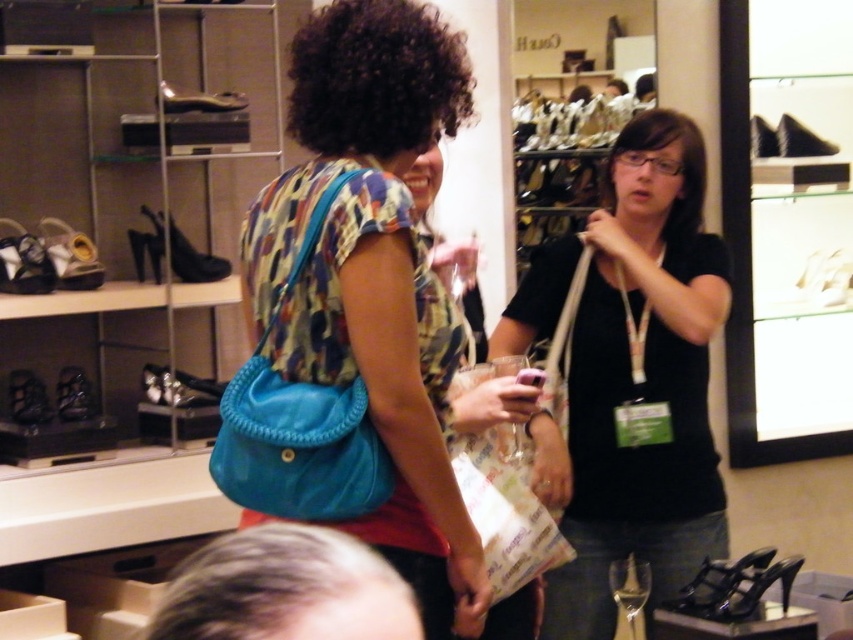
Is point (267, 570) closer to viewer compared to point (614, 148)?

Yes, point (267, 570) is in front of point (614, 148).

Consider the image. Who is more distant from viewer, (257, 566) or (699, 168)?

Positioned behind is point (699, 168).

Is point (242, 604) behind point (694, 218)?

That is False.

Image resolution: width=853 pixels, height=640 pixels. In order to click on curly hair at center in this screenshot , I will do click(x=285, y=589).

Does matte blue bag at center appear on the left side of matte blue fabric bag at center?

In fact, matte blue bag at center is to the right of matte blue fabric bag at center.

Is matte blue bag at center thinner than matte blue fabric bag at center?

No, matte blue bag at center is not thinner than matte blue fabric bag at center.

Which is behind, point (289, 241) or point (277, 406)?

Point (289, 241)

I want to click on matte blue bag at center, so click(374, 273).

Does black matte bag at center have a greater width compared to black curly hair at center?

Yes.

Which is more to the left, black matte bag at center or black curly hair at center?

Positioned to the left is black curly hair at center.

The width and height of the screenshot is (853, 640). Describe the element at coordinates (630, 378) in the screenshot. I see `black matte bag at center` at that location.

The height and width of the screenshot is (640, 853). In order to click on black matte bag at center in this screenshot , I will do `click(630, 378)`.